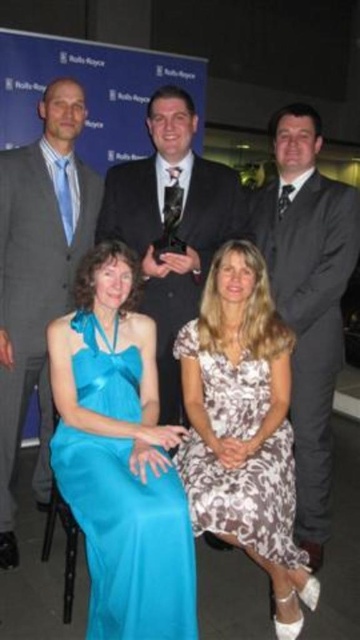
Between shiny black suit at center and brown floral dress at lower center, which one is positioned lower?

brown floral dress at lower center

How much distance is there between shiny black suit at center and brown floral dress at lower center?

A distance of 24.43 inches exists between shiny black suit at center and brown floral dress at lower center.

Between point (122, 176) and point (227, 364), which one is positioned in front?

Point (227, 364) is in front.

Image resolution: width=360 pixels, height=640 pixels. Identify the location of shiny black suit at center. (172, 225).

Which of these two, satin blue dress at lower left or gray suit at left, stands shorter?

satin blue dress at lower left

Between satin blue dress at lower left and gray suit at left, which one appears on the left side from the viewer's perspective?

gray suit at left

Is point (128, 419) in front of point (74, 188)?

Yes, point (128, 419) is closer to viewer.

At what (x,y) coordinates should I click in order to perform the action: click on satin blue dress at lower left. Please return your answer as a coordinate pair (x, y). Looking at the image, I should click on (120, 493).

Does satin blue dress at lower left appear over brown floral dress at lower center?

No, satin blue dress at lower left is not above brown floral dress at lower center.

Between point (92, 371) and point (195, 497), which one is positioned in front?

Point (195, 497) is more forward.

What are the coordinates of `satin blue dress at lower left` in the screenshot? It's located at (120, 493).